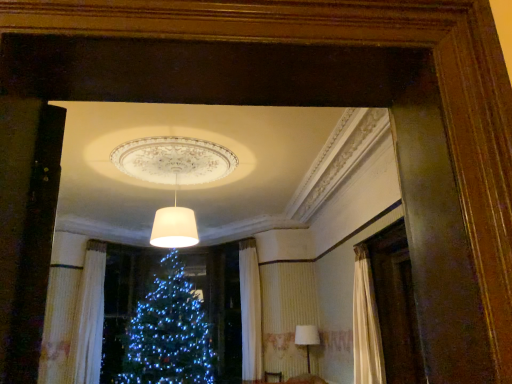
Question: Is white fabric lampshade at lower right, arranged as the 1th lamp when viewed from the back, inside or outside of white matte lampshade at center, which appears as the second lamp when viewed from the back?

Choices:
 (A) outside
 (B) inside

Answer: (A)

Question: From a real-world perspective, relative to white matte lampshade at center, which appears as the second lamp when viewed from the back, is white fabric lampshade at lower right, placed as the first lamp when sorted from right to left, vertically above or below?

Choices:
 (A) above
 (B) below

Answer: (B)

Question: Estimate the real-world distances between objects in this image. Which object is closer to the white fabric lampshade at lower right, the second lamp from the top?

Choices:
 (A) white textured curtain at lower left
 (B) white matte lampshade at center, which is the first lamp in front-to-back order

Answer: (B)

Question: Which object is the closest to the white matte lampshade at center, which appears as the second lamp when viewed from the back?

Choices:
 (A) white fabric lampshade at lower right, the second lamp positioned from the front
 (B) white textured curtain at lower left

Answer: (A)